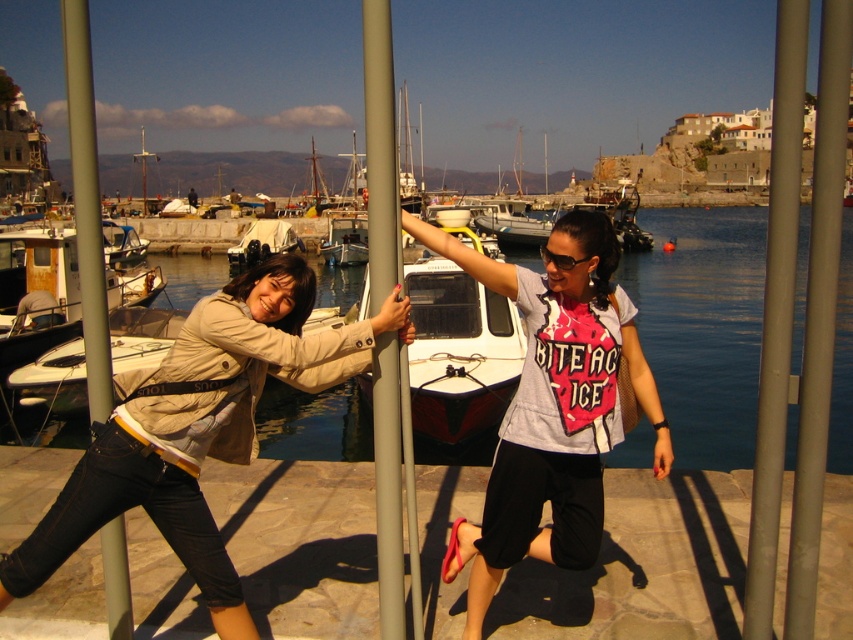
Question: Based on their relative distances, which object is farther from the satin silver pole at center?

Choices:
 (A) white tarpaulin boat at center
 (B) rusty metal boat at left

Answer: (A)

Question: Among these objects, which one is farthest from the camera?

Choices:
 (A) metallic gray pole at center
 (B) satin silver pole at center
 (C) metallic gray pole at right

Answer: (B)

Question: Does blue water at center have a lesser width compared to khaki fabric jacket at left?

Choices:
 (A) yes
 (B) no

Answer: (B)

Question: Is satin silver pole at center wider than smooth gray pole at left?

Choices:
 (A) no
 (B) yes

Answer: (A)

Question: Estimate the real-world distances between objects in this image. Which object is closer to the metallic gray pole at right?

Choices:
 (A) blue water at center
 (B) matte gray t-shirt at center
 (C) satin silver pole at center

Answer: (B)

Question: In this image, where is metallic gray pole at right located relative to sunglasses at center?

Choices:
 (A) right
 (B) left

Answer: (A)